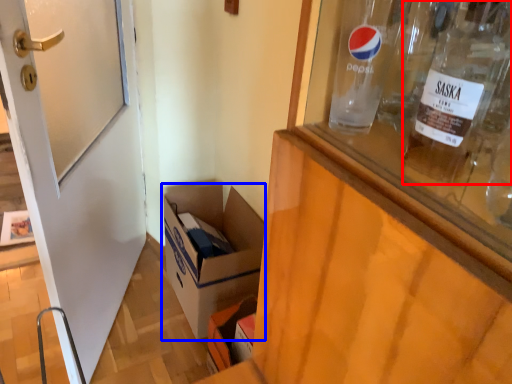
Question: Which object is further to the camera taking this photo, bottle (highlighted by a red box) or box (highlighted by a blue box)?

Choices:
 (A) bottle
 (B) box

Answer: (B)